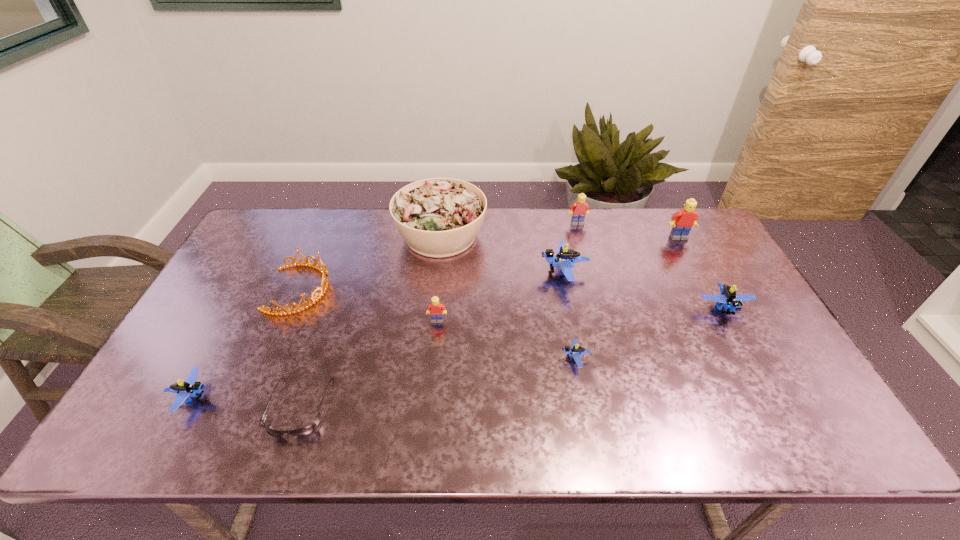
In order to click on blank space located on the front-facing side of the biggest blue Lego in this screenshot , I will do `click(411, 273)`.

Where is `free space located on the front-facing side of the tiara`? The image size is (960, 540). free space located on the front-facing side of the tiara is located at coordinates (375, 289).

Identify the location of free region located 0.230m on the front-facing side of the third smallest blue Lego. Image resolution: width=960 pixels, height=540 pixels. (773, 398).

The height and width of the screenshot is (540, 960). In order to click on free space located 0.120m on the front-facing side of the nearest yellow Lego in this screenshot , I will do `click(434, 359)`.

Identify the location of vacant area situated 0.140m on the front-facing side of the second shortest Lego. (272, 397).

Identify the location of free region located on the front-facing side of the third nearest object. The height and width of the screenshot is (540, 960). [432, 359].

Locate an element on the screen. This screenshot has height=540, width=960. vacant region located on the front-facing side of the third nearest object is located at coordinates (408, 359).

At what (x,y) coordinates should I click in order to perform the action: click on vacant space located on the front-facing side of the third nearest object. Please return your answer as a coordinate pair (x, y). Image resolution: width=960 pixels, height=540 pixels. Looking at the image, I should click on [x=444, y=359].

You are a GUI agent. You are given a task and a screenshot of the screen. Output one action in this format:
    pyautogui.click(x=<x>, y=<y>)
    Task: Click on the salad located at the far edge
    This screenshot has height=540, width=960.
    Given the screenshot: What is the action you would take?
    pyautogui.click(x=438, y=217)

Find the location of a particular element. The height and width of the screenshot is (540, 960). Lego that is at the near edge is located at coordinates (190, 388).